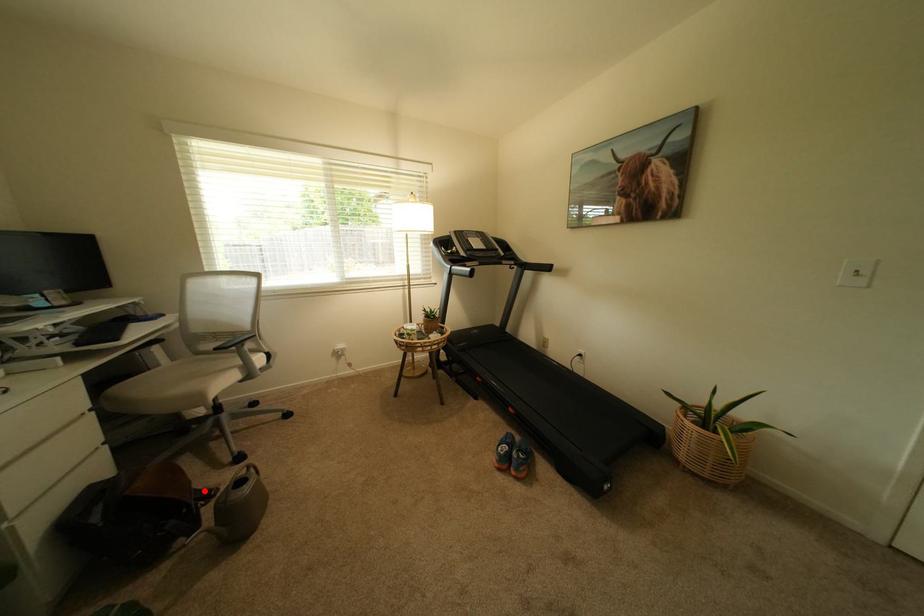
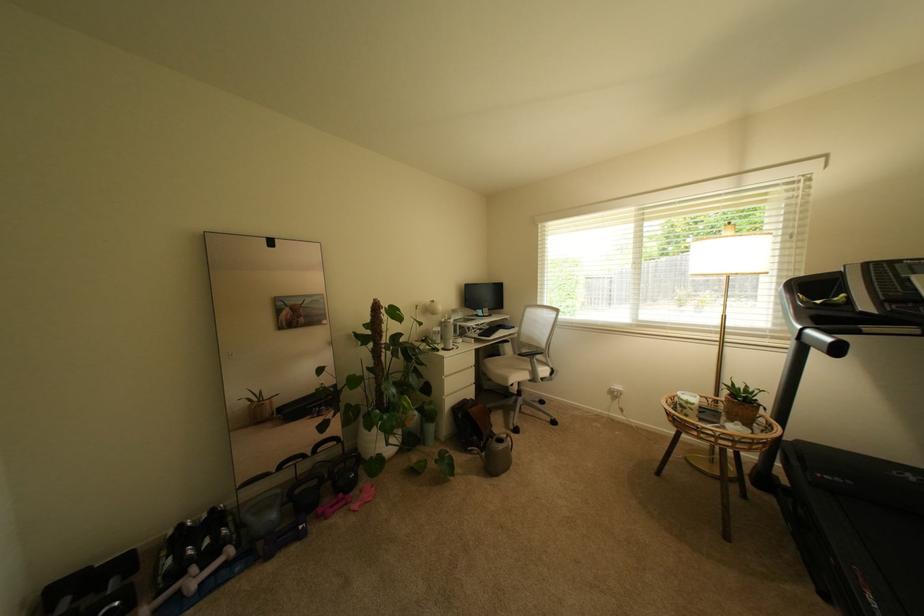
Where in the second image is the point corresponding to the highlighted location from the first image?

(500, 432)